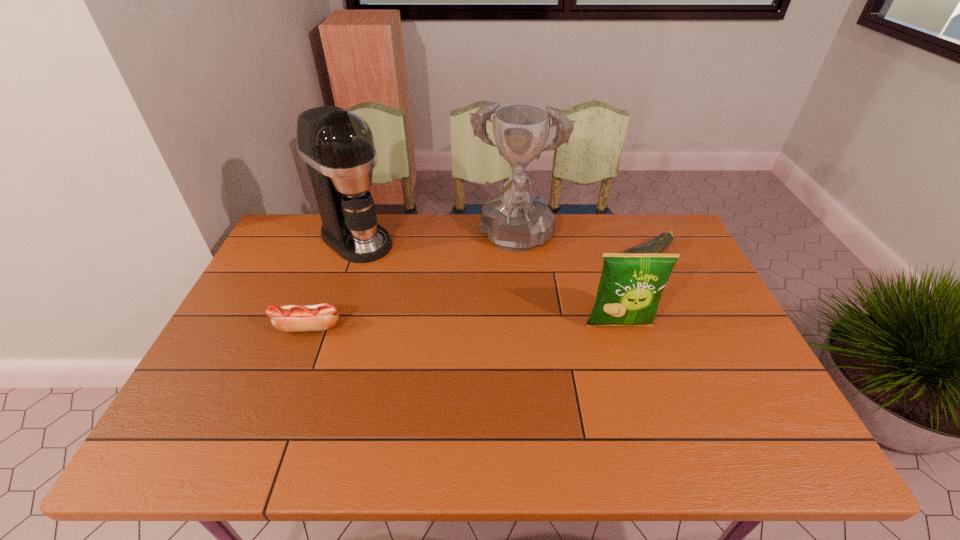
Find the location of `free spot that satisfies the following two spatial constraints: 1. on the back side of the zucchini; 2. on the right side of the sausage`. free spot that satisfies the following two spatial constraints: 1. on the back side of the zucchini; 2. on the right side of the sausage is located at coordinates (334, 259).